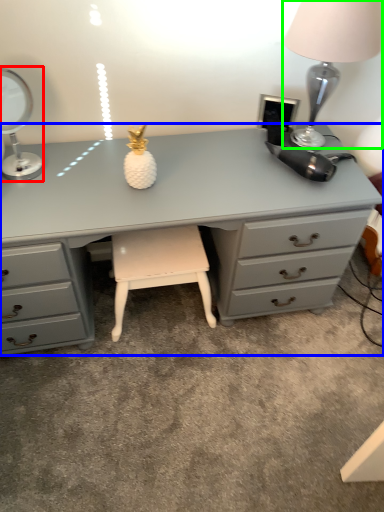
Question: Which is farther away from table lamp (highlighted by a red box)? desk (highlighted by a blue box) or table lamp (highlighted by a green box)?

Choices:
 (A) desk
 (B) table lamp

Answer: (B)